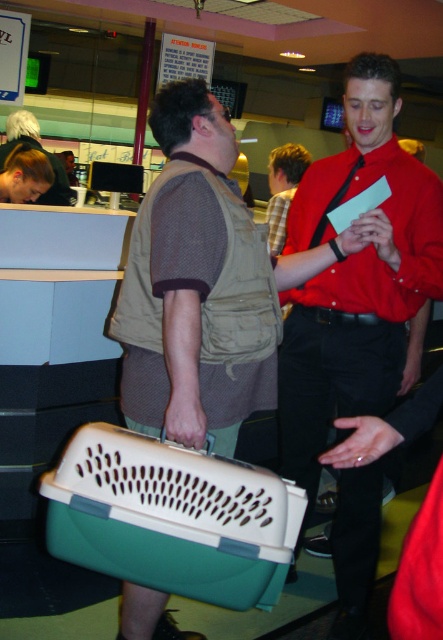
Question: Which of the following is the closest to the observer?

Choices:
 (A) matte black shirt at center
 (B) matte brown vest at center

Answer: (A)

Question: Which of the following is the closest to the observer?

Choices:
 (A) matte black shirt at center
 (B) matte plastic pet carrier at lower left

Answer: (B)

Question: Is matte plastic pet carrier at lower left smaller than matte brown vest at center?

Choices:
 (A) yes
 (B) no

Answer: (A)

Question: Which point appears closest to the camera in this image?

Choices:
 (A) (190, 412)
 (B) (58, 196)

Answer: (A)

Question: Does matte black shirt at center have a larger size compared to matte brown vest at center?

Choices:
 (A) yes
 (B) no

Answer: (B)

Question: Does matte plastic pet carrier at lower left appear on the left side of matte brown vest at center?

Choices:
 (A) no
 (B) yes

Answer: (A)